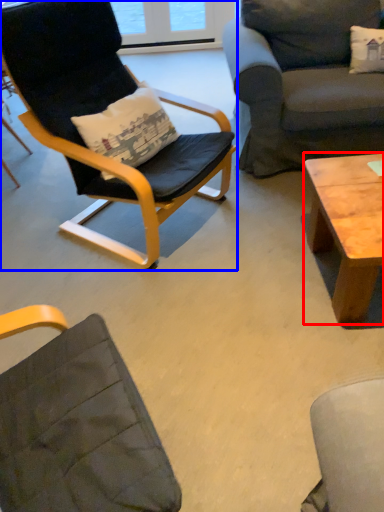
Question: Which point is further to the camera, coffee table (highlighted by a red box) or chair (highlighted by a blue box)?

Choices:
 (A) coffee table
 (B) chair

Answer: (A)